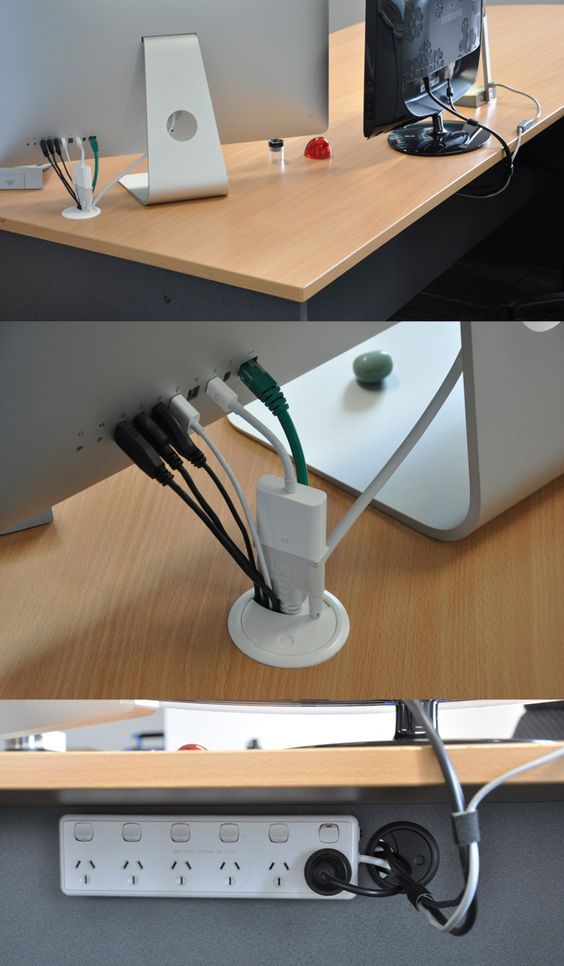
The width and height of the screenshot is (564, 966). What are the coordinates of `electric outlets` in the screenshot? It's located at (78, 864), (125, 865), (174, 863), (223, 863), (270, 865).